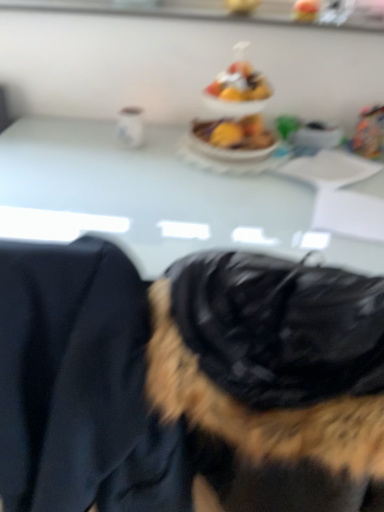
This screenshot has height=512, width=384. Identify the location of free space in front of shiny plastic fruit bowl at center. (208, 176).